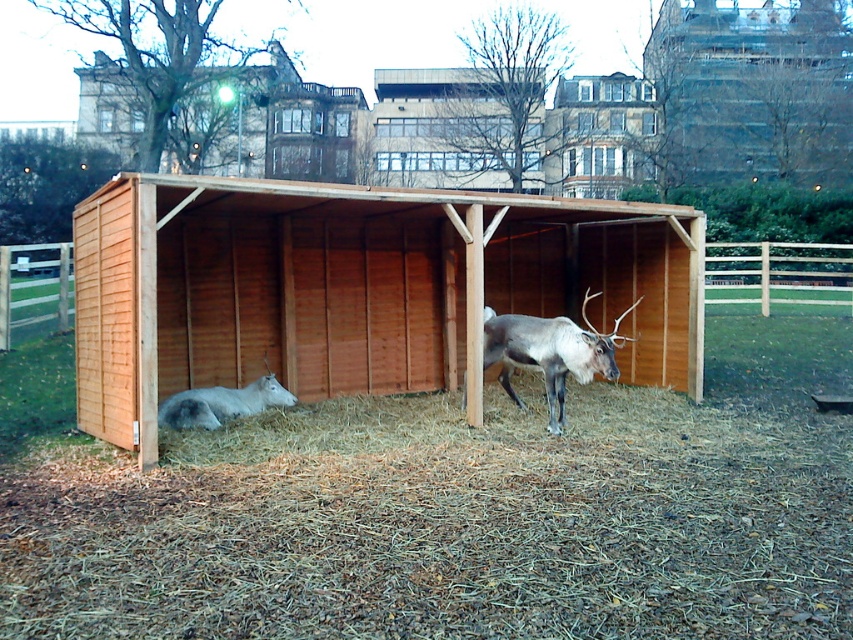
Question: Based on their relative distances, which object is nearer to the brown fur antlered deer at center?

Choices:
 (A) brown wooden barn at upper center
 (B) brown wooden barn at center
 (C) brown wooden hut at upper center
 (D) brown wooden shelter at center

Answer: (D)

Question: Which of the following is the closest to the observer?

Choices:
 (A) brown wooden barn at center
 (B) brown wooden barn at upper center
 (C) wooden shed at upper center
 (D) brown wooden hut at upper center

Answer: (B)

Question: Does brown wooden barn at upper center appear on the left side of brown wooden hut at upper center?

Choices:
 (A) no
 (B) yes

Answer: (B)

Question: Is brown wooden hut at upper center below brown fur antlered deer at center?

Choices:
 (A) yes
 (B) no

Answer: (B)

Question: Does wooden shed at upper center appear on the left side of white fur at lower left?

Choices:
 (A) no
 (B) yes

Answer: (A)

Question: Based on their relative distances, which object is farther from the brown wooden shelter at center?

Choices:
 (A) brown wooden barn at center
 (B) brown wooden barn at upper center
 (C) brown wooden hut at upper center
 (D) white fur at lower left

Answer: (C)